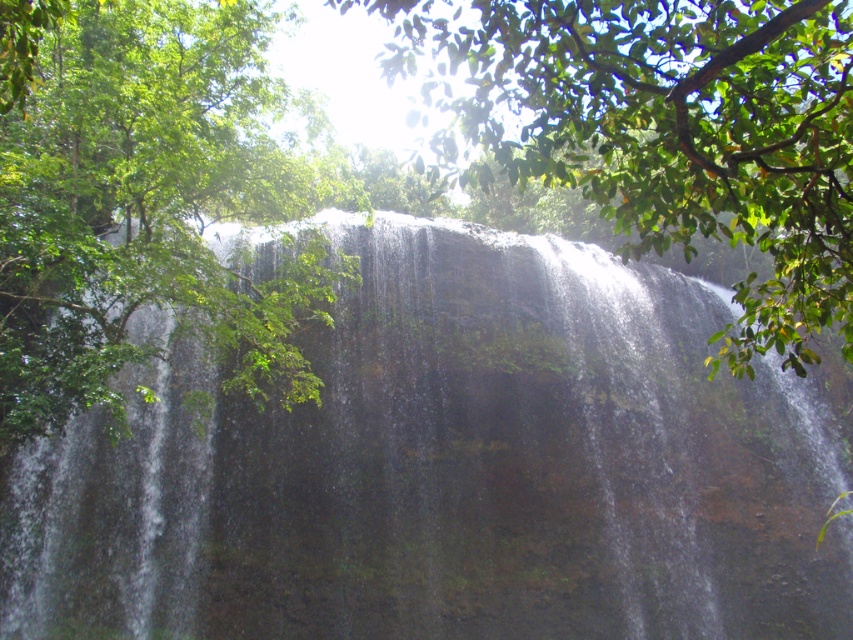
Who is more distant from viewer, (138, 324) or (628, 246)?

The point (138, 324) is more distant.

Between clear water at center and green leafy tree at center, which one is positioned higher?

green leafy tree at center

Measure the distance between clear water at center and camera.

clear water at center and camera are 10.41 meters apart from each other.

Identify the location of clear water at center. The width and height of the screenshot is (853, 640). (450, 470).

Is green leafy tree at upper left further to camera compared to green leafy tree at center?

That is True.

Based on the photo, can you confirm if green leafy tree at upper left is wider than green leafy tree at center?

Incorrect, green leafy tree at upper left's width does not surpass green leafy tree at center's.

Between point (294, 349) and point (531, 152), which one is positioned in front?

Point (531, 152)

This screenshot has width=853, height=640. What are the coordinates of `green leafy tree at upper left` in the screenshot? It's located at (143, 198).

Between clear water at center and green leafy tree at upper left, which one appears on the left side from the viewer's perspective?

green leafy tree at upper left is more to the left.

Does point (476, 493) come in front of point (218, 330)?

That is False.

Image resolution: width=853 pixels, height=640 pixels. What do you see at coordinates (450, 470) in the screenshot? I see `clear water at center` at bounding box center [450, 470].

Locate an element on the screen. The height and width of the screenshot is (640, 853). clear water at center is located at coordinates (450, 470).